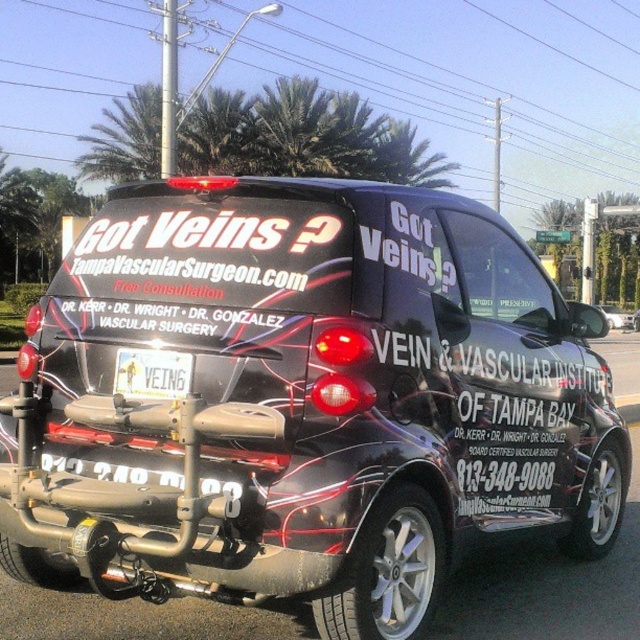
Based on the photo, can you confirm if black matte vehicle at center is taller than black matte car at center?

Yes, black matte vehicle at center is taller than black matte car at center.

Identify the location of black matte vehicle at center. (304, 401).

Is black matte vehicle at center smaller than white plastic license plate at rear?

No.

Locate an element on the screen. This screenshot has height=640, width=640. black matte vehicle at center is located at coordinates (304, 401).

This screenshot has width=640, height=640. What are the coordinates of `black matte vehicle at center` in the screenshot? It's located at (304, 401).

Is white plastic license plate at rear below glossy black car at center?

Correct, white plastic license plate at rear is located below glossy black car at center.

Does point (166, 380) lie in front of point (618, 308)?

Yes, it is in front of point (618, 308).

This screenshot has width=640, height=640. What are the coordinates of `white plastic license plate at rear` in the screenshot? It's located at (152, 372).